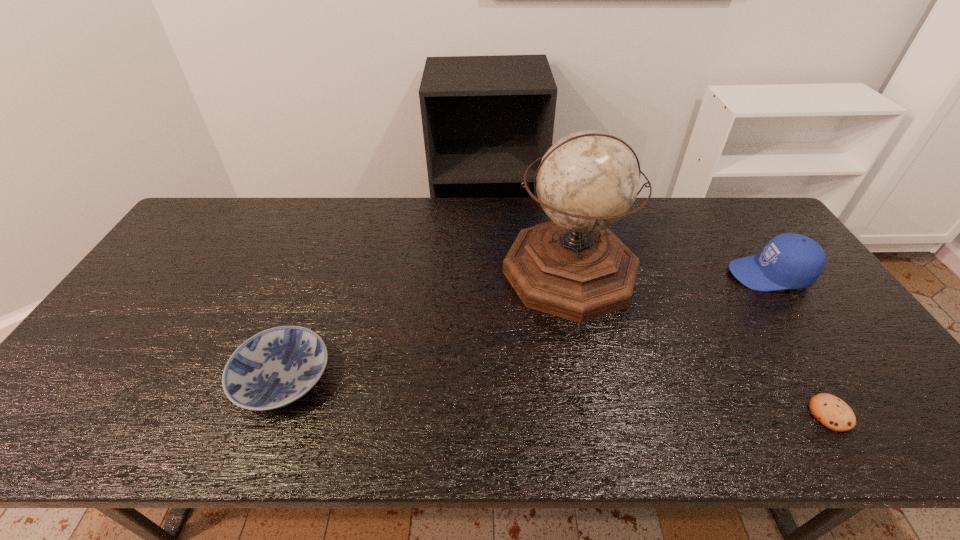
Locate an element on the screen. This screenshot has width=960, height=540. blank area at the left edge is located at coordinates (200, 271).

Image resolution: width=960 pixels, height=540 pixels. Find the location of `vacant space at the right edge of the desktop`. vacant space at the right edge of the desktop is located at coordinates (733, 241).

Locate an element on the screen. This screenshot has width=960, height=540. vacant space at the near left corner is located at coordinates (76, 434).

The width and height of the screenshot is (960, 540). What are the coordinates of `free space at the far right corner` in the screenshot? It's located at (756, 218).

You are a GUI agent. You are given a task and a screenshot of the screen. Output one action in this format:
    pyautogui.click(x=<x>, y=<y>)
    Task: Click on the empty space between the leftmost object and the cap
    
    Given the screenshot: What is the action you would take?
    pyautogui.click(x=526, y=327)

Where is `vacant point located between the cookie and the leftmost object`? vacant point located between the cookie and the leftmost object is located at coordinates (557, 396).

At what (x,y) coordinates should I click in order to perform the action: click on free point between the shortest object and the second shortest object. Please return your answer as a coordinate pair (x, y). Looking at the image, I should click on (557, 396).

Image resolution: width=960 pixels, height=540 pixels. What are the coordinates of `free space between the third shortest object and the plate` in the screenshot? It's located at (526, 327).

What are the coordinates of `vacant space that's between the third tallest object and the shortest object` in the screenshot? It's located at (557, 396).

Find the location of a particular element. This screenshot has height=540, width=960. vacant area that lies between the second tallest object and the cookie is located at coordinates pos(800,344).